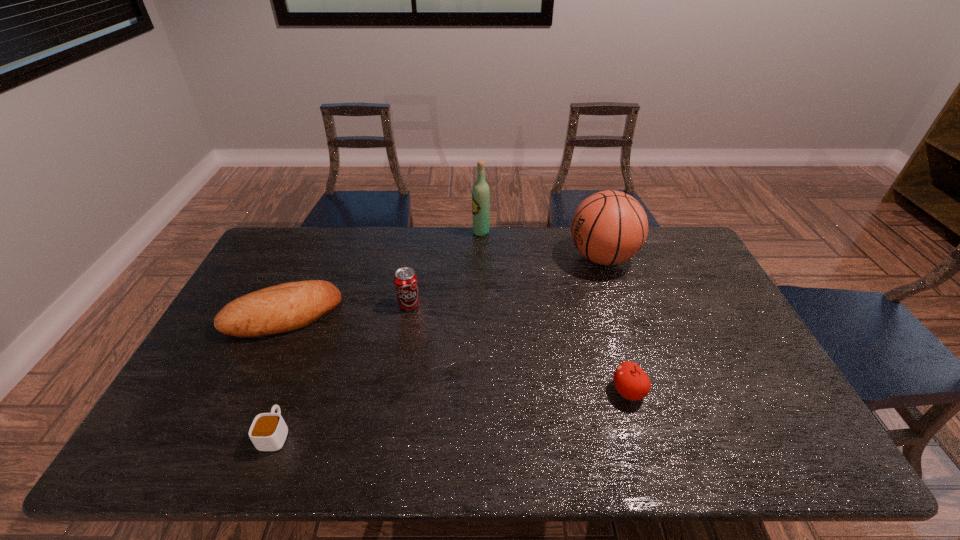
I want to click on the tallest object, so click(x=480, y=192).

Where is `the third object from right to left`? This screenshot has width=960, height=540. the third object from right to left is located at coordinates pyautogui.click(x=480, y=192).

Where is `basketball`? basketball is located at coordinates (610, 227).

The height and width of the screenshot is (540, 960). Identify the location of the fourth shortest object. (406, 283).

Locate an element on the screen. The width and height of the screenshot is (960, 540). soda is located at coordinates (406, 283).

Locate an element on the screen. The width and height of the screenshot is (960, 540). the fifth farthest object is located at coordinates (630, 380).

This screenshot has width=960, height=540. In order to click on bread in this screenshot , I will do pyautogui.click(x=286, y=307).

Identify the location of cup. The image size is (960, 540). (268, 432).

The height and width of the screenshot is (540, 960). What are the coordinates of `the nearest object` in the screenshot? It's located at (268, 432).

The image size is (960, 540). In order to click on free space located on the front-facing side of the third object from right to left in this screenshot , I will do 398,232.